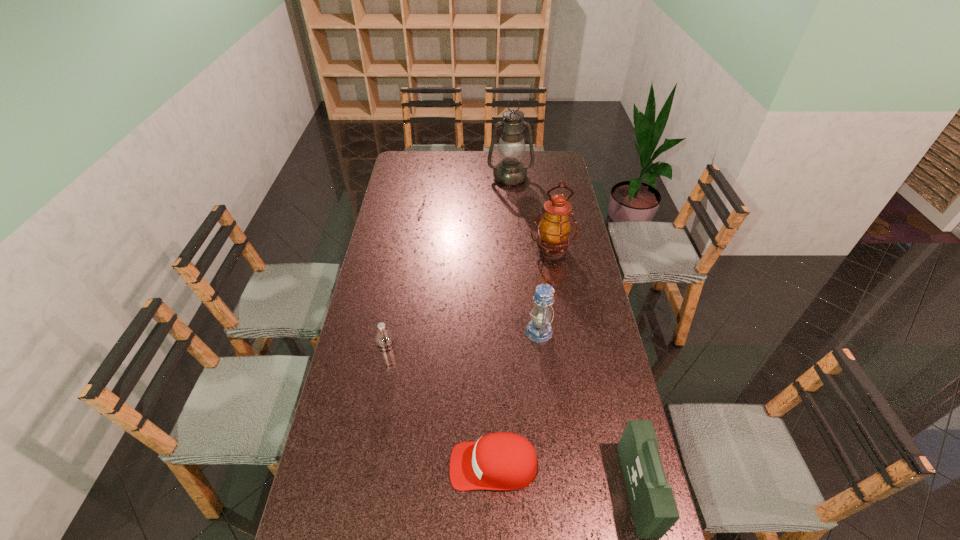
Where is `object identified as the fifth closest to the third farthest object`? object identified as the fifth closest to the third farthest object is located at coordinates pos(510,171).

Identify which object is the third nearest to the lantern. Please provide its 2D coordinates. Your answer should be formatted as a tuple, i.e. [(x, y)], where the tuple contains the x and y coordinates of a point satisfying the conditions above.

[(654, 510)]

Locate an element on the screen. The image size is (960, 540). vacant position in the image that satisfies the following two spatial constraints: 1. on the front-facing side of the fourth nearest object; 2. on the front label of the vodka is located at coordinates (542, 362).

Find the location of a particular element. free space in the image that satisfies the following two spatial constraints: 1. on the front side of the second farthest object; 2. on the front-facing side of the baseball cap is located at coordinates (588, 465).